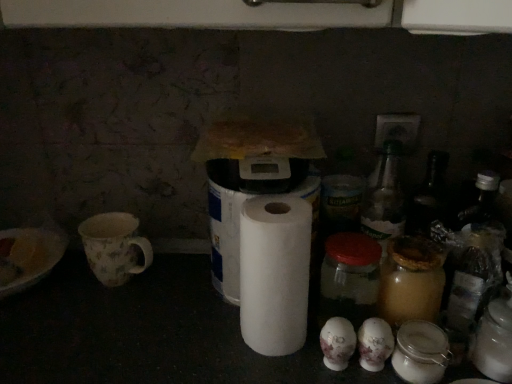
Question: Does white matte toilet paper at lower center, acting as the second toilet paper starting from the left, have a greater height compared to white paper at center?

Choices:
 (A) no
 (B) yes

Answer: (A)

Question: Does white matte toilet paper at lower center, acting as the second toilet paper starting from the left, appear on the right side of white paper at center?

Choices:
 (A) yes
 (B) no

Answer: (A)

Question: From a real-world perspective, is white matte toilet paper at lower center, positioned as the second toilet paper in right-to-left order, under white paper at center?

Choices:
 (A) yes
 (B) no

Answer: (A)

Question: Is white matte toilet paper at lower center, acting as the second toilet paper starting from the left, shorter than white paper at center?

Choices:
 (A) no
 (B) yes

Answer: (B)

Question: Is white matte toilet paper at lower center, acting as the second toilet paper starting from the left, positioned in front of white paper at center?

Choices:
 (A) yes
 (B) no

Answer: (B)

Question: Considering their positions, is white paper at center located in front of or behind white matte toilet paper at lower center, acting as the second toilet paper starting from the left?

Choices:
 (A) behind
 (B) front

Answer: (B)

Question: Is white paper at center taller or shorter than white matte toilet paper at lower center, positioned as the second toilet paper in right-to-left order?

Choices:
 (A) tall
 (B) short

Answer: (A)

Question: From a real-world perspective, is white paper at center positioned above or below white matte toilet paper at lower center, positioned as the second toilet paper in right-to-left order?

Choices:
 (A) below
 (B) above

Answer: (B)

Question: Visually, is white paper at center positioned to the left or to the right of white matte toilet paper at lower center, acting as the second toilet paper starting from the left?

Choices:
 (A) left
 (B) right

Answer: (A)

Question: Is point (350, 352) positioned closer to the camera than point (328, 268)?

Choices:
 (A) farther
 (B) closer

Answer: (B)

Question: From the image's perspective, is white matte toilet paper at lower center, positioned as the second toilet paper in right-to-left order, positioned above or below transparent glass jar at center?

Choices:
 (A) above
 (B) below

Answer: (B)

Question: From a real-world perspective, is white matte toilet paper at lower center, acting as the second toilet paper starting from the left, physically located above or below transparent glass jar at center?

Choices:
 (A) above
 (B) below

Answer: (B)

Question: Considering the relative positions of white matte toilet paper at lower center, positioned as the second toilet paper in right-to-left order, and transparent glass jar at center in the image provided, is white matte toilet paper at lower center, positioned as the second toilet paper in right-to-left order, to the left or to the right of transparent glass jar at center?

Choices:
 (A) left
 (B) right

Answer: (A)

Question: Considering the positions of white matte toilet paper at center, the first toilet paper positioned from the left, and white paper at center in the image, is white matte toilet paper at center, the first toilet paper positioned from the left, bigger or smaller than white paper at center?

Choices:
 (A) small
 (B) big

Answer: (B)

Question: Considering their positions, is white matte toilet paper at center, the first toilet paper positioned from the left, located in front of or behind white paper at center?

Choices:
 (A) front
 (B) behind

Answer: (B)